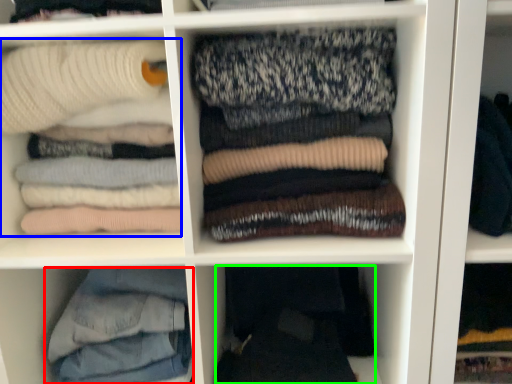
Question: Estimate the real-world distances between objects in this image. Which object is closer to trousers (highlighted by a red box), laundry (highlighted by a blue box) or clothing (highlighted by a green box)?

Choices:
 (A) laundry
 (B) clothing

Answer: (B)